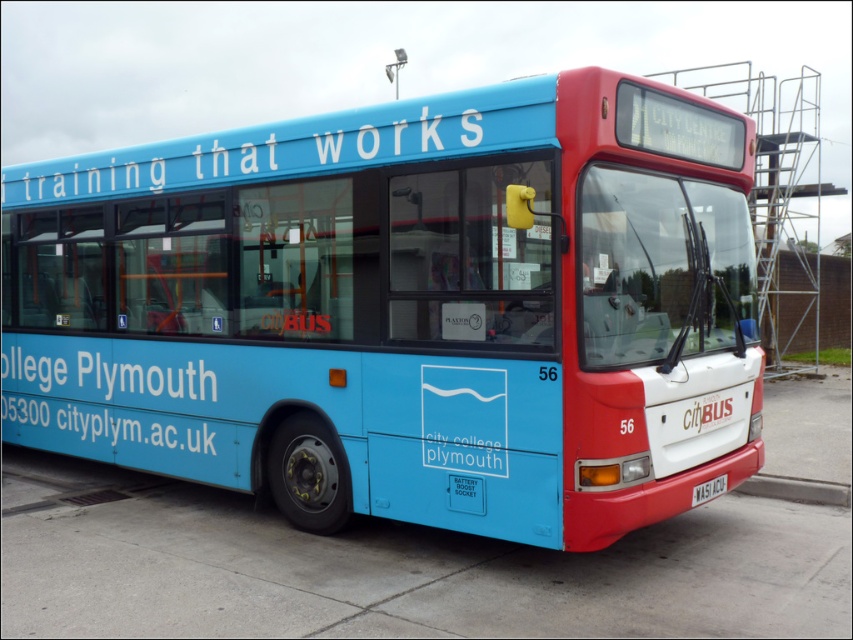
Between point (758, 493) and point (717, 493), which one is positioned behind?

The point (758, 493) is behind.

Is gray concrete curb at lower right to the right of black plastic license plate at lower right from the viewer's perspective?

Yes, gray concrete curb at lower right is to the right of black plastic license plate at lower right.

Which is behind, point (846, 497) or point (711, 497)?

The point (846, 497) is more distant.

Image resolution: width=853 pixels, height=640 pixels. I want to click on gray concrete curb at lower right, so click(x=796, y=490).

Is matte blue bus at center bigger than black plastic license plate at lower right?

Yes, matte blue bus at center is bigger than black plastic license plate at lower right.

Does matte blue bus at center have a greater width compared to black plastic license plate at lower right?

Incorrect, matte blue bus at center's width does not surpass black plastic license plate at lower right's.

Is point (432, 252) farther from viewer compared to point (704, 493)?

No, it is in front of (704, 493).

Locate an element on the screen. The height and width of the screenshot is (640, 853). matte blue bus at center is located at coordinates (405, 308).

Can you confirm if blue matte text at lower left is smaller than gray concrete curb at lower right?

Actually, blue matte text at lower left might be larger than gray concrete curb at lower right.

Who is more distant from viewer, (105, 388) or (746, 488)?

The point (105, 388) is more distant.

Does point (49, 374) come closer to viewer compared to point (746, 481)?

No, it is not.

I want to click on blue matte text at lower left, so click(x=105, y=403).